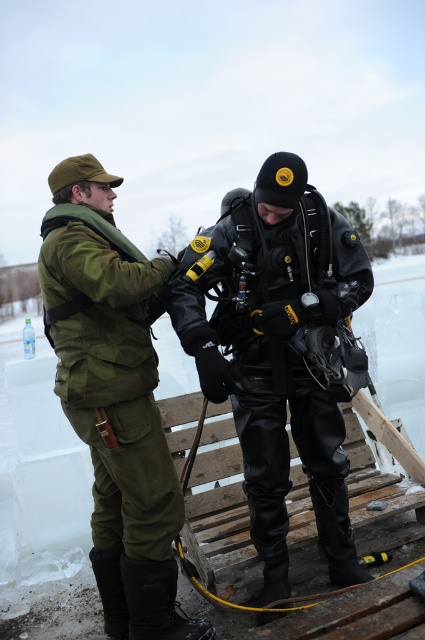
Is point (272, 273) farther from viewer compared to point (95, 202)?

Yes.

Does black leather diving suit at center appear over green matte uniform at left?

Correct, black leather diving suit at center is located above green matte uniform at left.

You are a GUI agent. You are given a task and a screenshot of the screen. Output one action in this format:
    pyautogui.click(x=<x>, y=<y>)
    Task: Click on the black leather diving suit at center
    The image size is (425, 640).
    Given the screenshot: What is the action you would take?
    pyautogui.click(x=275, y=353)